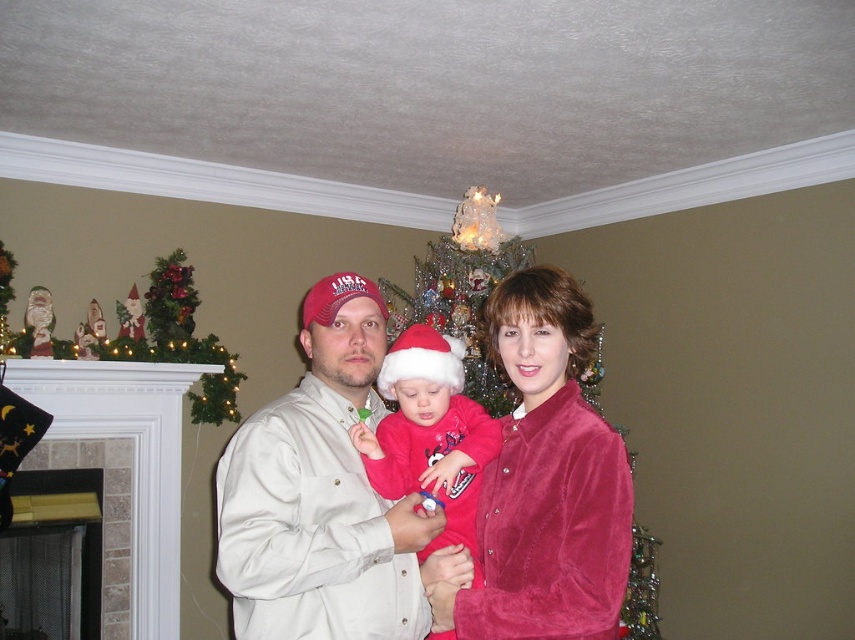
You are a photographer standing at the camera position. You want to take a photo of the matte khaki shirt at center. Can you reach it with your hand to adjust it before taking the photo?

The matte khaki shirt at center is 1.49 meters away from the camera, so you cannot reach it with your hand to adjust it before taking the photo.

You are a photographer setting up for a family photo. You need to ensure that the matte khaki shirt at center and the wooden figurines at upper left are both visible in the frame. Based on their sizes, which object should you prioritize keeping closer to the camera to maintain clarity?

The matte khaki shirt at center is not as tall as the wooden figurines at upper left, so you should prioritize keeping the wooden figurines at upper left closer to the camera to maintain clarity since they are taller and might be more detailed.

You are a photographer setting up a camera in the living room. You want to focus on the matte khaki shirt at center. According to the coordinates provided, where should you position your camera to capture the shirt in the center of the frame?

The matte khaki shirt at center is located at coordinates point (321, 493), so you should position your camera to center the frame at those coordinates to capture it.